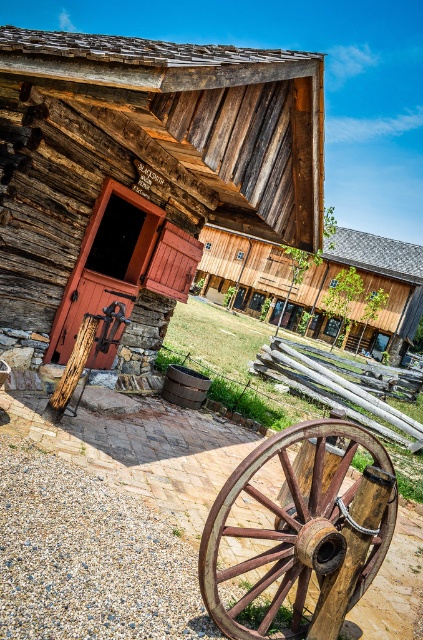
Measure the distance from rustic wood barn at center to rustic wood wagon wheel at center.

3.40 meters

Does rustic wood barn at center appear on the left side of rustic wood wagon wheel at center?

Correct, you'll find rustic wood barn at center to the left of rustic wood wagon wheel at center.

Is point (271, 65) farther from camera compared to point (365, 480)?

Yes, point (271, 65) is farther from viewer.

Identify the location of rustic wood barn at center. (142, 177).

Can you confirm if rustic wood barn at center is bigger than wooden barn at center?

No.

Who is lower down, rustic wood barn at center or wooden barn at center?

wooden barn at center is lower down.

Describe the element at coordinates (142, 177) in the screenshot. I see `rustic wood barn at center` at that location.

Find the location of `rustic wood barn at center`. rustic wood barn at center is located at coordinates (142, 177).

Does rustic wood wagon wheel at center have a smaller size compared to wooden barn at center?

Yes, rustic wood wagon wheel at center is smaller than wooden barn at center.

Does rustic wood wagon wheel at center appear on the left side of wooden barn at center?

Yes, rustic wood wagon wheel at center is to the left of wooden barn at center.

Image resolution: width=423 pixels, height=640 pixels. What do you see at coordinates (296, 532) in the screenshot?
I see `rustic wood wagon wheel at center` at bounding box center [296, 532].

Where is `rustic wood wagon wheel at center`? rustic wood wagon wheel at center is located at coordinates (296, 532).